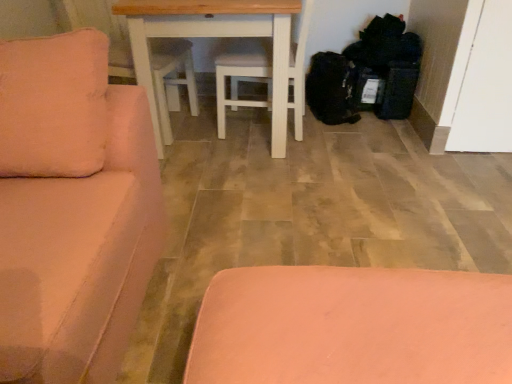
Measure the distance between velvet pink couch at left and camera.

velvet pink couch at left is 25.43 inches away from camera.

What do you see at coordinates (72, 210) in the screenshot? I see `velvet pink couch at left` at bounding box center [72, 210].

What is the approximate width of pink matte ottoman at lower center?

The width of pink matte ottoman at lower center is 82.87 centimeters.

What is the approximate height of white painted wood table at center?

white painted wood table at center is 30.84 inches tall.

Image resolution: width=512 pixels, height=384 pixels. What are the coordinates of `black fabric bags at lower right` in the screenshot? It's located at (368, 73).

Is black fabric bags at lower right thinner than white painted wood table at center?

Yes, black fabric bags at lower right is thinner than white painted wood table at center.

Does black fabric bags at lower right have a lesser height compared to white painted wood table at center?

Correct, black fabric bags at lower right is not as tall as white painted wood table at center.

Does point (403, 38) appear closer or farther from the camera than point (135, 17)?

Point (403, 38) is farther from the camera than point (135, 17).

Does black fabric bags at lower right have a smaller size compared to white painted wood table at center?

Indeed, black fabric bags at lower right has a smaller size compared to white painted wood table at center.

Looking at this image, is black fabric bags at lower right in contact with pink matte ottoman at lower center?

No, black fabric bags at lower right is not in contact with pink matte ottoman at lower center.

Based on the photo, between black fabric bags at lower right and pink matte ottoman at lower center, which one has larger width?

With larger width is pink matte ottoman at lower center.

From the image's perspective, relative to pink matte ottoman at lower center, is black fabric bags at lower right above or below?

From the image's perspective, black fabric bags at lower right appears above pink matte ottoman at lower center.

Considering the sizes of objects velvet pink couch at left and white painted wood table at center in the image provided, who is thinner, velvet pink couch at left or white painted wood table at center?

With smaller width is velvet pink couch at left.

In terms of height, does velvet pink couch at left look taller or shorter compared to white painted wood table at center?

In the image, velvet pink couch at left appears to be taller than white painted wood table at center.

Between point (143, 186) and point (183, 28), which one is positioned behind?

The point (183, 28) is more distant.

Is the surface of pink matte ottoman at lower center in direct contact with black fabric bags at lower right?

No, pink matte ottoman at lower center is not with black fabric bags at lower right.

Considering the relative positions of pink matte ottoman at lower center and black fabric bags at lower right in the image provided, is pink matte ottoman at lower center in front of black fabric bags at lower right?

Yes.

From a real-world perspective, does pink matte ottoman at lower center stand above black fabric bags at lower right?

No.

I want to click on furniture in front of the black fabric bags at lower right, so click(352, 327).

Is black fabric bags at lower right at the back of velvet pink couch at left?

No.

From the image's perspective, would you say velvet pink couch at left is shown under black fabric bags at lower right?

Indeed, from the image's perspective, velvet pink couch at left is shown beneath black fabric bags at lower right.

Does velvet pink couch at left appear on the right side of black fabric bags at lower right?

No.

Where is `studio couch above the black fabric bags at lower right (from a real-world perspective)`? The image size is (512, 384). studio couch above the black fabric bags at lower right (from a real-world perspective) is located at coordinates (72, 210).

Considering the relative sizes of white painted wood table at center and pink matte ottoman at lower center in the image provided, is white painted wood table at center taller than pink matte ottoman at lower center?

Yes, white painted wood table at center is taller than pink matte ottoman at lower center.

Is pink matte ottoman at lower center at the back of white painted wood table at center?

white painted wood table at center is not turned away from pink matte ottoman at lower center.

From the picture: Is white painted wood table at center inside the boundaries of pink matte ottoman at lower center, or outside?

white painted wood table at center exists outside the volume of pink matte ottoman at lower center.

In terms of width, does white painted wood table at center look wider or thinner when compared to pink matte ottoman at lower center?

In the image, white painted wood table at center appears to be more narrow than pink matte ottoman at lower center.

Is pink matte ottoman at lower center at the left side of velvet pink couch at left?

No, pink matte ottoman at lower center is not to the left of velvet pink couch at left.

Can you confirm if pink matte ottoman at lower center is shorter than velvet pink couch at left?

Indeed, pink matte ottoman at lower center has a lesser height compared to velvet pink couch at left.

Does point (454, 303) come behind point (83, 201)?

No, it is not.

The height and width of the screenshot is (384, 512). What are the coordinates of `garbage located underneath the white painted wood table at center (from a real-world perspective)` in the screenshot? It's located at (368, 73).

At what (x,y) coordinates should I click in order to perform the action: click on garbage above the pink matte ottoman at lower center (from a real-world perspective). Please return your answer as a coordinate pair (x, y). The image size is (512, 384). Looking at the image, I should click on (368, 73).

Considering their positions, is white painted wood table at center positioned further to black fabric bags at lower right than pink matte ottoman at lower center?

pink matte ottoman at lower center.

Considering their positions, is velvet pink couch at left positioned closer to white painted wood table at center than black fabric bags at lower right?

black fabric bags at lower right lies closer to white painted wood table at center than the other object.

Consider the image. Considering their positions, is pink matte ottoman at lower center positioned further to velvet pink couch at left than black fabric bags at lower right?

black fabric bags at lower right.

Looking at the image, which one is located further to white painted wood table at center, black fabric bags at lower right or velvet pink couch at left?

velvet pink couch at left.

Considering their positions, is white painted wood table at center positioned further to black fabric bags at lower right than velvet pink couch at left?

The object further to black fabric bags at lower right is velvet pink couch at left.

Considering their positions, is velvet pink couch at left positioned further to black fabric bags at lower right than white painted wood table at center?

velvet pink couch at left is positioned further to the anchor black fabric bags at lower right.

When comparing their distances from black fabric bags at lower right, does pink matte ottoman at lower center or velvet pink couch at left seem further?

pink matte ottoman at lower center.

Looking at the image, which one is located closer to velvet pink couch at left, black fabric bags at lower right or pink matte ottoman at lower center?

Among the two, pink matte ottoman at lower center is located nearer to velvet pink couch at left.

Where is `furniture between velvet pink couch at left and white painted wood table at center in the front-back direction`? furniture between velvet pink couch at left and white painted wood table at center in the front-back direction is located at coordinates (352, 327).

What are the coordinates of `table between velvet pink couch at left and black fabric bags at lower right in the front-back direction` in the screenshot? It's located at (217, 37).

The height and width of the screenshot is (384, 512). What are the coordinates of `table between pink matte ottoman at lower center and black fabric bags at lower right along the z-axis` in the screenshot? It's located at (217, 37).

The width and height of the screenshot is (512, 384). I want to click on furniture positioned between velvet pink couch at left and black fabric bags at lower right from near to far, so click(x=352, y=327).